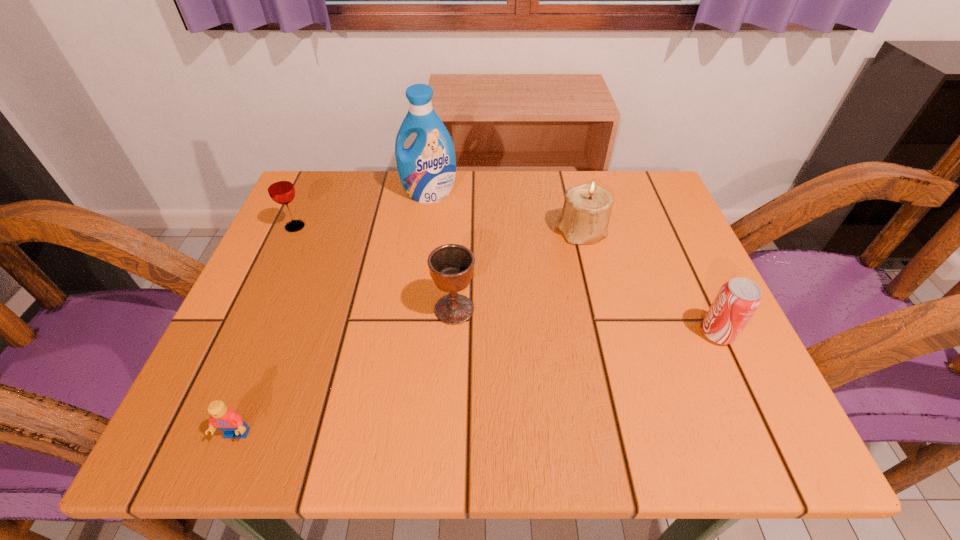
You are a GUI agent. You are given a task and a screenshot of the screen. Output one action in this format:
    pyautogui.click(x=<x>, y=<y>)
    Task: Click on the detergent
    
    Given the screenshot: What is the action you would take?
    pyautogui.click(x=427, y=169)

You are a GUI agent. You are given a task and a screenshot of the screen. Output one action in this format:
    pyautogui.click(x=<x>, y=<y>)
    Task: Click on the farthest object
    This screenshot has width=960, height=540.
    Given the screenshot: What is the action you would take?
    pyautogui.click(x=427, y=169)

This screenshot has width=960, height=540. Find the location of `candle_holder`. candle_holder is located at coordinates (586, 211).

Locate an element on the screen. This screenshot has width=960, height=540. the leftmost object is located at coordinates [281, 190].

Locate an element on the screen. This screenshot has height=540, width=960. chalice is located at coordinates coord(451,266).

This screenshot has width=960, height=540. Find the location of `soda can`. soda can is located at coordinates (738, 299).

I want to click on Lego, so click(x=227, y=420).

Locate an element on the screen. the nearest object is located at coordinates (227, 420).

Find the location of a particular element. The image size is (960, 540). free location located 0.130m on the front-facing side of the detergent is located at coordinates (423, 239).

The width and height of the screenshot is (960, 540). Identify the location of vacant space located on the left of the candle_holder. (381, 232).